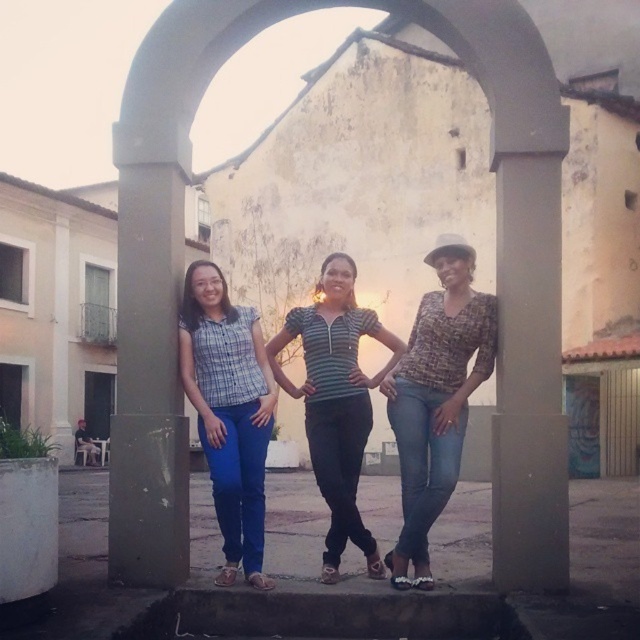
You are a photographer trying to capture a group photo of the blue denim jeans at center and the striped fabric shirt at center. The camera you are using has a minimum focusing distance of 6 feet. Can you take a clear photo of both subjects without moving them?

The blue denim jeans at center is 6.77 feet from striped fabric shirt at center. Since the distance between them is greater than the camera minimum focusing distance of 6 feet, you can take a clear photo of both subjects without moving them.

You are a photographer trying to capture a wide shot of the scene. The camera you are using has a maximum width of 1 meter. Given the concrete at center and blue jeans at center, which object will fit within the camera frame if you focus on them individually?

The concrete at center has a width less than the blue jeans at center, so the concrete at center will fit within the camera frame of 1 meter width, while the blue jeans at center might not fit if its width exceeds 1 meter.